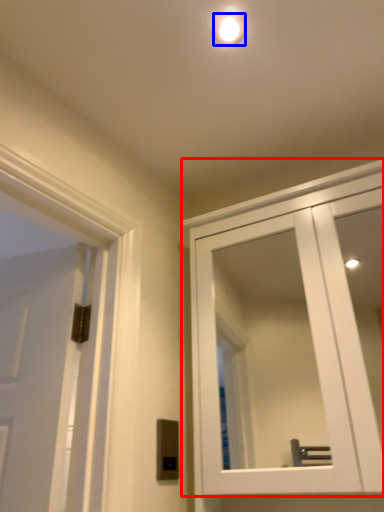
Question: Which point is further to the camera, cabinetry (highlighted by a red box) or droplight (highlighted by a blue box)?

Choices:
 (A) cabinetry
 (B) droplight

Answer: (B)